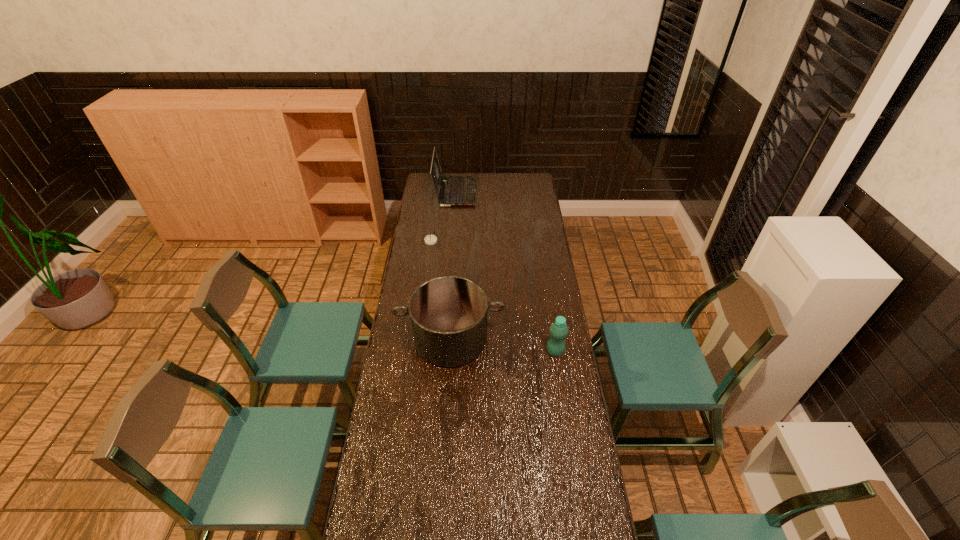
Where is `laptop computer`? Image resolution: width=960 pixels, height=540 pixels. laptop computer is located at coordinates (456, 190).

The height and width of the screenshot is (540, 960). What are the coordinates of `pan` in the screenshot? It's located at (448, 314).

Where is `the rightmost object`? The image size is (960, 540). the rightmost object is located at coordinates (559, 330).

Identify the location of the shortest object. (430, 239).

The width and height of the screenshot is (960, 540). In order to click on compass in this screenshot , I will do `click(430, 239)`.

Identify the location of free space located 0.390m on the screen of the laptop computer. This screenshot has height=540, width=960. (538, 192).

At what (x,y) coordinates should I click in order to perform the action: click on vacant region located 0.130m on the right of the pan. Please return your answer as a coordinate pair (x, y). This screenshot has height=540, width=960. Looking at the image, I should click on (535, 339).

What are the coordinates of `free space located at the front cap of the rightmost object` in the screenshot? It's located at (485, 352).

You are a GUI agent. You are given a task and a screenshot of the screen. Output one action in this format:
    pyautogui.click(x=<x>, y=<y>)
    Task: Click on the vacant space situated at the front cap of the rightmost object
    
    Given the screenshot: What is the action you would take?
    pyautogui.click(x=506, y=352)

The image size is (960, 540). What are the coordinates of `blank space located 0.340m at the front cap of the rightmost object` in the screenshot? It's located at (466, 352).